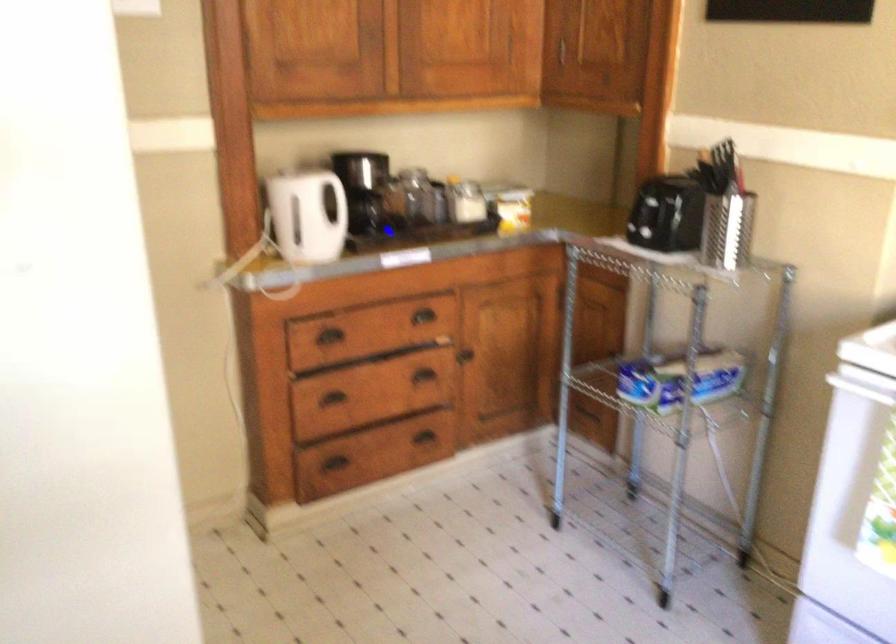
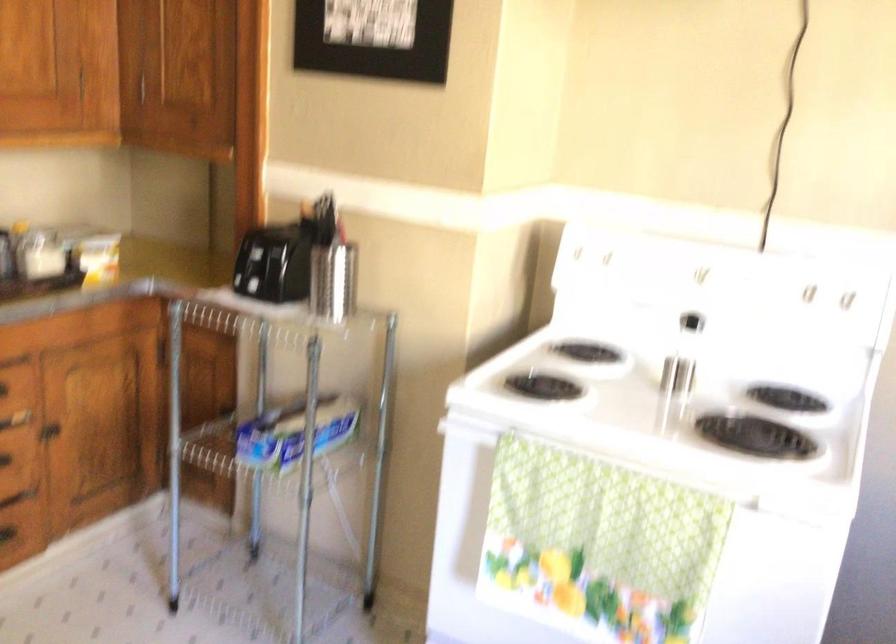
Find the pixel in the second image that matches (x=460, y=357) in the first image.

(48, 431)